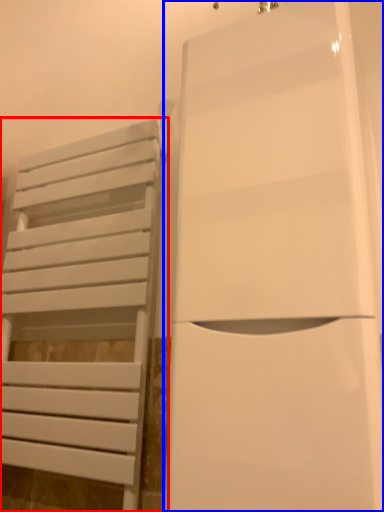
Question: Which point is closer to the camera, furniture (highlighted by a red box) or door (highlighted by a blue box)?

Choices:
 (A) furniture
 (B) door

Answer: (B)